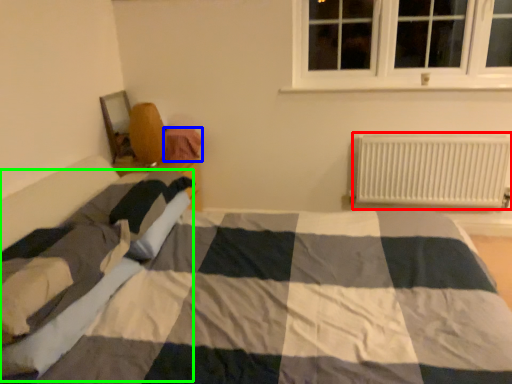
Question: Which is nearer to the radiator (highlighted by a red box)? material (highlighted by a blue box) or blanket (highlighted by a green box).

Choices:
 (A) material
 (B) blanket

Answer: (A)